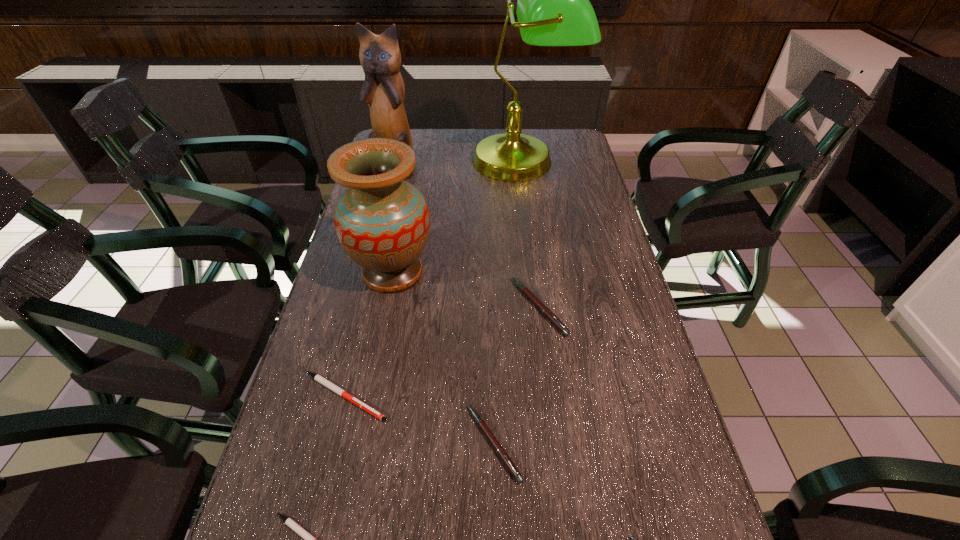
Where is `free space at the far left corner of the desktop`? The width and height of the screenshot is (960, 540). free space at the far left corner of the desktop is located at coordinates (416, 145).

Where is `vacant space at the far right corner of the desktop`? The width and height of the screenshot is (960, 540). vacant space at the far right corner of the desktop is located at coordinates (557, 136).

In order to click on free space between the leftmost pink pen and the cat in this screenshot , I will do click(x=444, y=305).

Locate an element on the screen. free area in between the third pen from left to right and the biggest pink pen is located at coordinates (516, 375).

I want to click on free space between the third tallest object and the second farthest pink pen, so click(444, 358).

This screenshot has width=960, height=540. Find the location of `object identified as the third closest to the rightmost pink pen`. object identified as the third closest to the rightmost pink pen is located at coordinates (309, 539).

Identify which object is located as the fifth nearest to the third tallest object. Please provide its 2D coordinates. Your answer should be formatted as a tuple, i.e. [(x, y)], where the tuple contains the x and y coordinates of a point satisfying the conditions above.

[(383, 91)]

Locate which pen ranks third in proximity to the cat. Please provide its 2D coordinates. Your answer should be formatted as a tuple, i.e. [(x, y)], where the tuple contains the x and y coordinates of a point satisfying the conditions above.

[(501, 452)]

The width and height of the screenshot is (960, 540). I want to click on pen that can be found as the second closest to the nearer white pen, so click(501, 452).

Locate an element on the screen. The width and height of the screenshot is (960, 540). pink pen that is the second closest one to the second nearest pink pen is located at coordinates (633, 538).